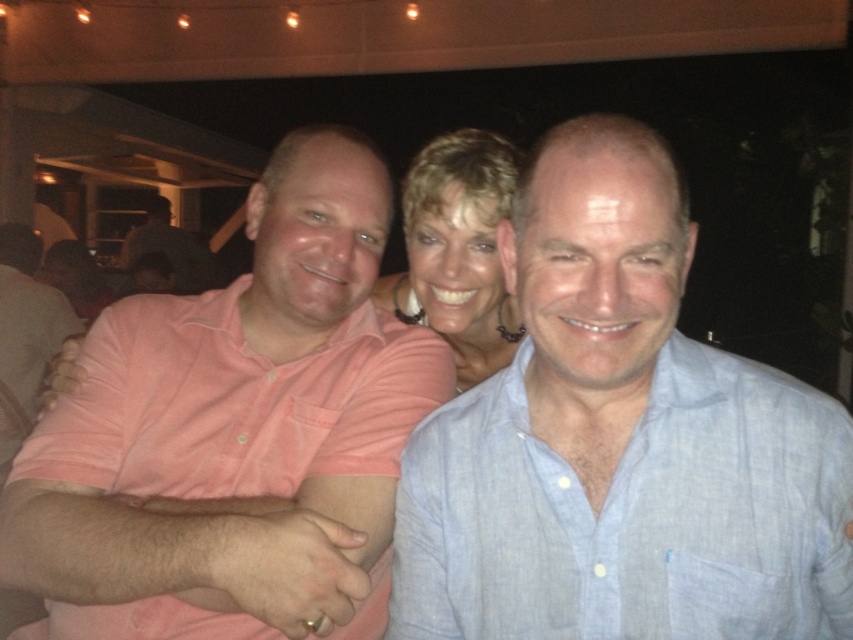
Based on the photo, you are a photographer trying to focus on the matte gold necklace at center. The pink cotton shirt at center is blocking part of the necklace. Can you adjust your camera angle to capture the necklace without the shirt obscuring it?

The pink cotton shirt at center is larger than the matte gold necklace at center, so adjusting the camera angle might be challenging. However, by slightly tilting the camera downward or moving it to the side, you could potentially frame the shot to avoid the shirt obstructing the necklace.

You are a photographer adjusting your camera settings to focus on two specific points in the image. The first point is at coordinates point (848, 445) and the second is at point (364, 301). Which point should you focus on first if you want to ensure the closest object is in sharp focus?

Point (848, 445) is closer to the viewer than point (364, 301), so you should focus on point (848, 445) first to ensure the closest object is in sharp focus.

Consider the image. You are a photographer at the event and want to adjust the lighting for the three people. The light blue linen shirt at center and the pink cotton shirt at center are both in the frame. Which of the two shirts is positioned to the right side of the other?

The light blue linen shirt at center is to the right of the pink cotton shirt at center according to the description.